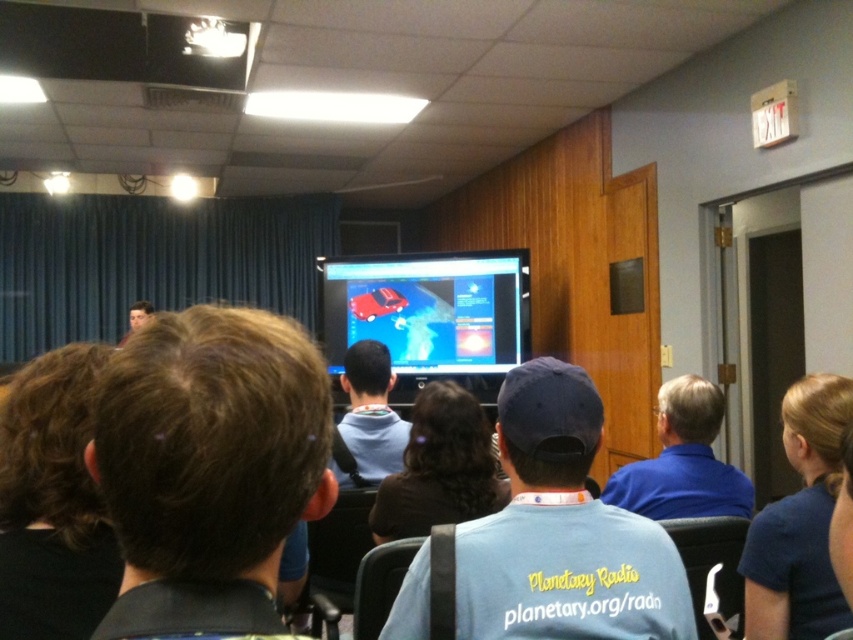
Question: Is light blue cotton t-shirt at center smaller than brown hair at center?

Choices:
 (A) yes
 (B) no

Answer: (A)

Question: Does brown hair at center appear on the left side of light blue hoodie at center?

Choices:
 (A) no
 (B) yes

Answer: (A)

Question: Estimate the real-world distances between objects in this image. Which object is closer to the blue shirt at lower right?

Choices:
 (A) light blue hoodie at center
 (B) blue shirt at right
 (C) light blue cotton t-shirt at center

Answer: (B)

Question: Which of the following is the farthest from the observer?

Choices:
 (A) (140, 456)
 (B) (531, 516)
 (C) (408, 442)

Answer: (C)

Question: Where is light blue cotton t-shirt at center located in relation to blue shirt at lower right in the image?

Choices:
 (A) below
 (B) above

Answer: (B)

Question: Which point appears closest to the camera in this image?

Choices:
 (A) (485, 433)
 (B) (843, 417)
 (C) (204, 420)

Answer: (C)